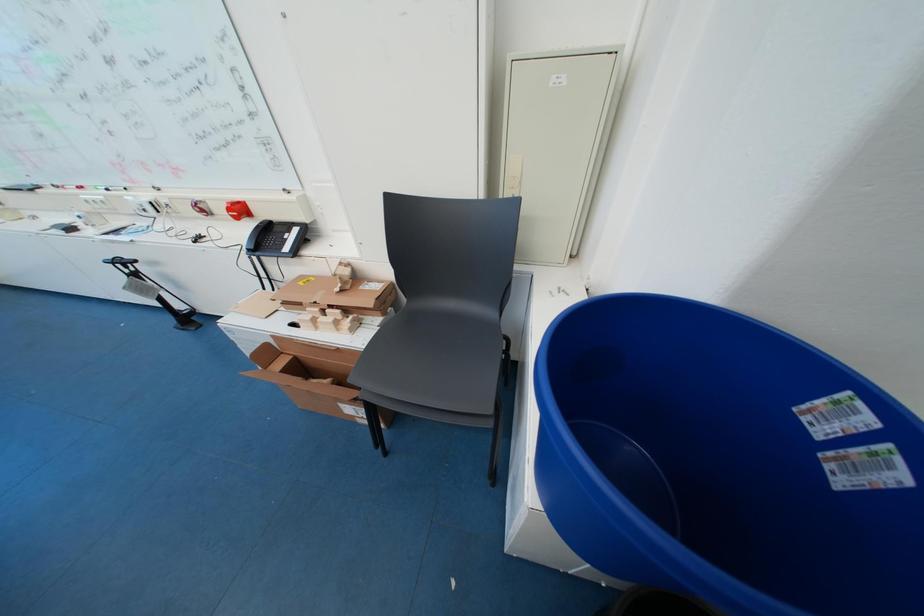
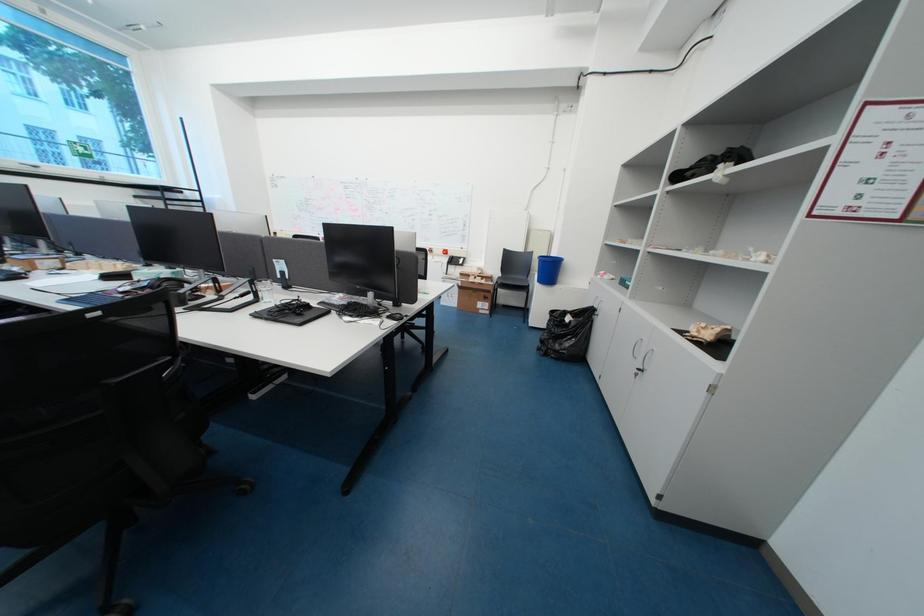
What movement of the cameraman would produce the second image?

The movement direction of the cameraman is left, backward.